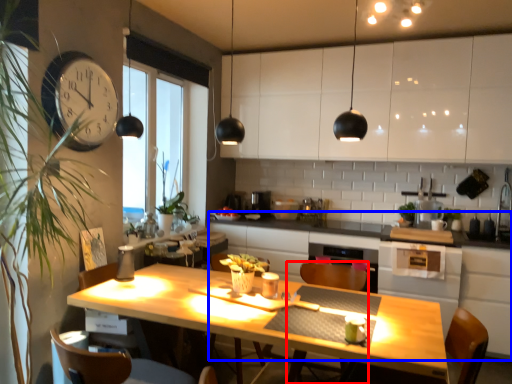
Question: Among these objects, which one is nearest to the camera, armchair (highlighted by a red box) or counter (highlighted by a blue box)?

Choices:
 (A) armchair
 (B) counter

Answer: (A)